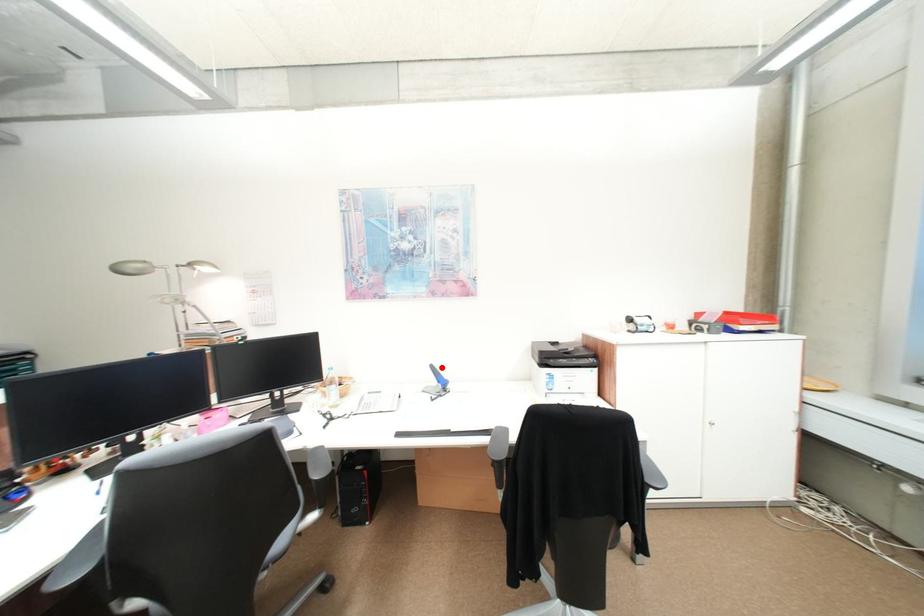
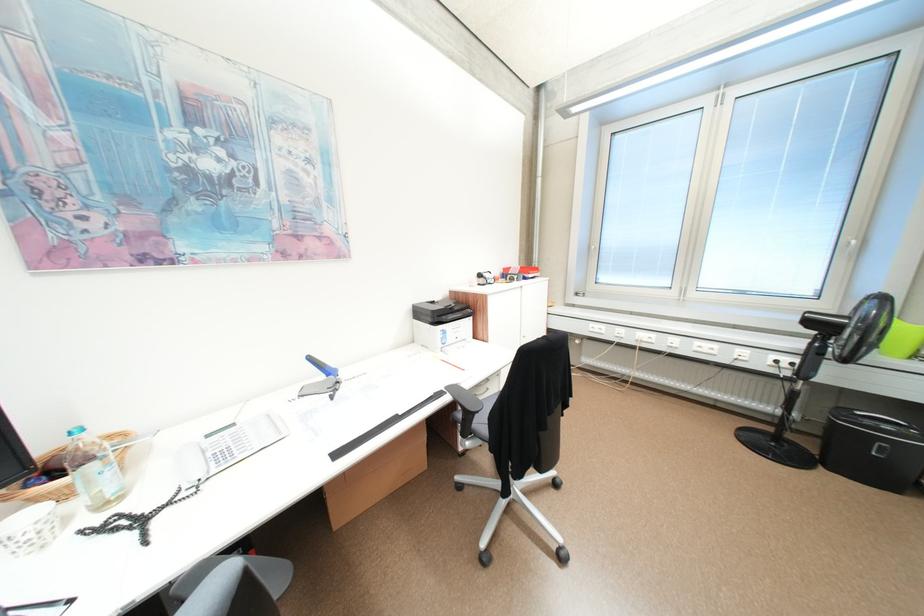
Locate, in the second image, the point that corresponds to the highlighted location in the first image.

(320, 359)